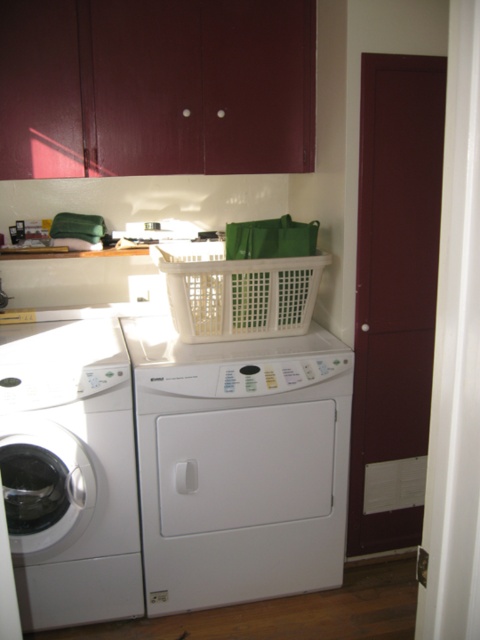
Question: Is white glossy washing machine at left to the left of white plastic basket at center from the viewer's perspective?

Choices:
 (A) yes
 (B) no

Answer: (A)

Question: Estimate the real-world distances between objects in this image. Which object is closer to the white glossy washing machine at left?

Choices:
 (A) white plastic washing machine at center
 (B) white plastic basket at center

Answer: (A)

Question: Which of these objects is positioned closest to the white plastic washing machine at center?

Choices:
 (A) white glossy washing machine at left
 (B) white plastic basket at center

Answer: (A)

Question: Is white plastic washing machine at center bigger than white plastic basket at center?

Choices:
 (A) yes
 (B) no

Answer: (A)

Question: Which point appears closest to the camera in this image?

Choices:
 (A) (33, 620)
 (B) (322, 496)
 (C) (191, 292)

Answer: (A)

Question: Is white plastic washing machine at center above white glossy washing machine at left?

Choices:
 (A) yes
 (B) no

Answer: (B)